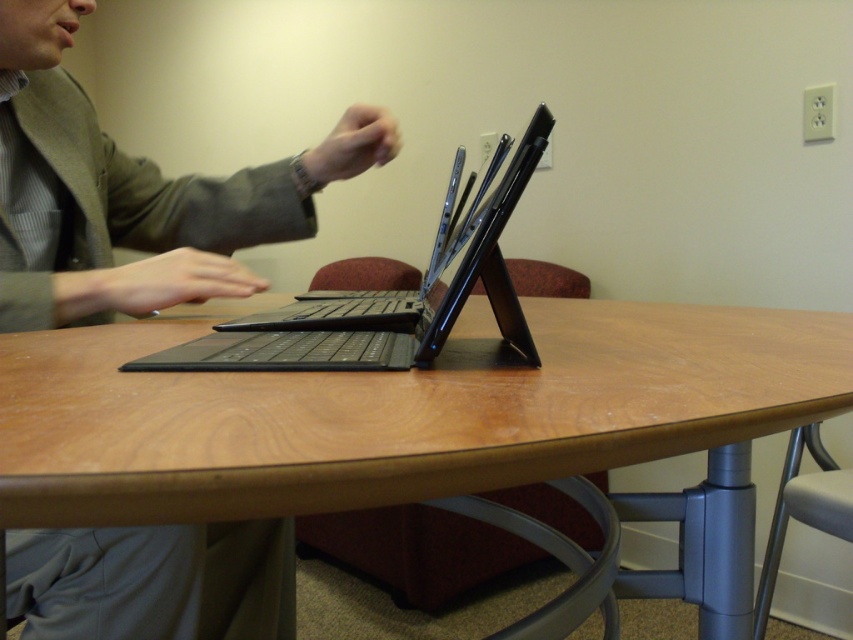
Question: Which point is farther from the camera taking this photo?

Choices:
 (A) (44, 566)
 (B) (260, 358)

Answer: (A)

Question: Is matte black laptop at center bigger than black matte laptop at center?

Choices:
 (A) no
 (B) yes

Answer: (B)

Question: Is wooden table at center further to the viewer compared to matte black laptop at center?

Choices:
 (A) no
 (B) yes

Answer: (A)

Question: Among these objects, which one is nearest to the camera?

Choices:
 (A) black matte laptop at center
 (B) matte black laptop at center
 (C) wooden table at center

Answer: (C)

Question: Which is nearer to the matte black laptop at center?

Choices:
 (A) wooden table at center
 (B) black matte laptop at center

Answer: (B)

Question: Is matte black laptop at center positioned before black matte laptop at center?

Choices:
 (A) yes
 (B) no

Answer: (B)